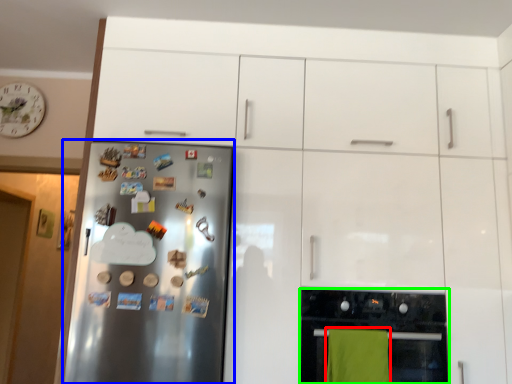
Question: Estimate the real-world distances between objects in this image. Which object is closer to beach towel (highlighted by a red box), refrigerator (highlighted by a blue box) or home appliance (highlighted by a green box)?

Choices:
 (A) refrigerator
 (B) home appliance

Answer: (B)